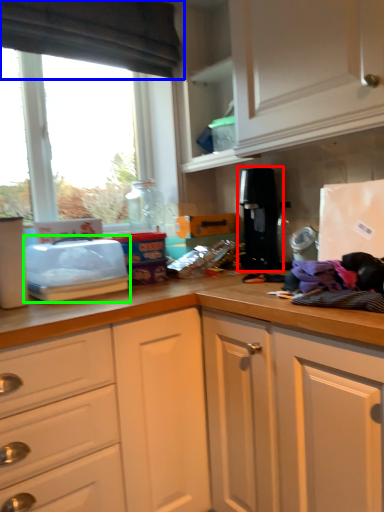
Question: Based on their relative distances, which object is nearer to coffee machine (highlighted by a red box)? Choose from exhaust hood (highlighted by a blue box) and appliance (highlighted by a green box).

Choices:
 (A) exhaust hood
 (B) appliance

Answer: (B)